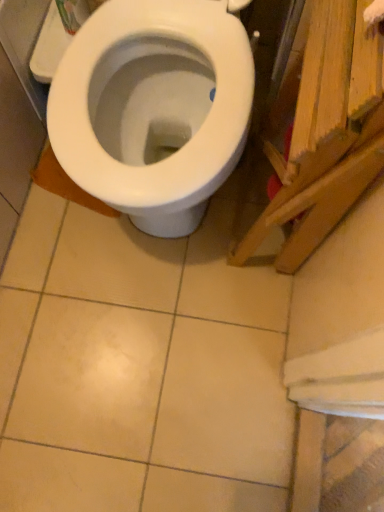
In the scene shown: What is the approximate width of white glossy bidet at center?

It is 25.46 inches.

Describe the element at coordinates (154, 108) in the screenshot. The height and width of the screenshot is (512, 384). I see `white glossy bidet at center` at that location.

The image size is (384, 512). In order to click on white glossy bidet at center in this screenshot , I will do `click(154, 108)`.

Locate an element on the screen. The width and height of the screenshot is (384, 512). wooden plank at right is located at coordinates (326, 134).

What do you see at coordinates (326, 134) in the screenshot? I see `wooden plank at right` at bounding box center [326, 134].

Find the location of a particular element. white glossy bidet at center is located at coordinates (154, 108).

Would you say white glossy bidet at center is to the left or to the right of wooden plank at right in the picture?

white glossy bidet at center is to the left of wooden plank at right.

Is white glossy bidet at center closer to camera compared to wooden plank at right?

That is False.

Does point (183, 202) appear closer or farther from the camera than point (377, 141)?

Point (183, 202) is positioned farther from the camera compared to point (377, 141).

From the image's perspective, between white glossy bidet at center and wooden plank at right, which one is located above?

white glossy bidet at center, from the image's perspective.

From a real-world perspective, which object stands above the other?

wooden plank at right.

Considering the sizes of objects white glossy bidet at center and wooden plank at right in the image provided, who is thinner, white glossy bidet at center or wooden plank at right?

With smaller width is wooden plank at right.

Between white glossy bidet at center and wooden plank at right, which one has more height?

With more height is wooden plank at right.

Which of these two, white glossy bidet at center or wooden plank at right, is smaller?

Smaller between the two is wooden plank at right.

Is white glossy bidet at center situated inside wooden plank at right or outside?

The correct answer is: outside.

Is white glossy bidet at center positioned far away from wooden plank at right?

That's not correct — white glossy bidet at center is a little close to wooden plank at right.

Is white glossy bidet at center oriented towards wooden plank at right?

No, white glossy bidet at center is not oriented towards wooden plank at right.

Identify the location of wood that is on the right side of white glossy bidet at center. This screenshot has width=384, height=512. 326,134.

In the image, is wooden plank at right on the left side or the right side of white glossy bidet at center?

In the image, wooden plank at right appears on the right side of white glossy bidet at center.

Is wooden plank at right positioned in front of white glossy bidet at center?

Yes.

Between point (332, 218) and point (238, 53), which one is positioned in front?

Positioned in front is point (332, 218).

From the image's perspective, which one is positioned lower, wooden plank at right or white glossy bidet at center?

From the image's view, wooden plank at right is below.

From a real-world perspective, is wooden plank at right located higher than white glossy bidet at center?

Yes, from a real-world perspective, wooden plank at right is on top of white glossy bidet at center.

Is wooden plank at right wider or thinner than white glossy bidet at center?

Clearly, wooden plank at right has less width compared to white glossy bidet at center.

Based on the photo, considering the relative sizes of wooden plank at right and white glossy bidet at center in the image provided, is wooden plank at right shorter than white glossy bidet at center?

In fact, wooden plank at right may be taller than white glossy bidet at center.

In terms of size, does wooden plank at right appear bigger or smaller than white glossy bidet at center?

wooden plank at right is smaller than white glossy bidet at center.

Is wooden plank at right inside the boundaries of white glossy bidet at center, or outside?

wooden plank at right is not enclosed by white glossy bidet at center.

Is there a large distance between wooden plank at right and white glossy bidet at center?

wooden plank at right is actually quite close to white glossy bidet at center.

Does wooden plank at right turn towards white glossy bidet at center?

No, wooden plank at right is not aimed at white glossy bidet at center.

What's the angular difference between wooden plank at right and white glossy bidet at center's facing directions?

They differ by 0.00116 degrees in their facing directions.

In the scene shown: Measure the distance from wooden plank at right to white glossy bidet at center.

wooden plank at right is 9.41 inches from white glossy bidet at center.

The height and width of the screenshot is (512, 384). I want to click on bidet directly beneath the wooden plank at right (from a real-world perspective), so click(x=154, y=108).

At what (x,y) coordinates should I click in order to perform the action: click on wood that appears in front of the white glossy bidet at center. Please return your answer as a coordinate pair (x, y). Looking at the image, I should click on (326, 134).

Locate an element on the screen. The height and width of the screenshot is (512, 384). wood below the white glossy bidet at center (from the image's perspective) is located at coordinates (326, 134).